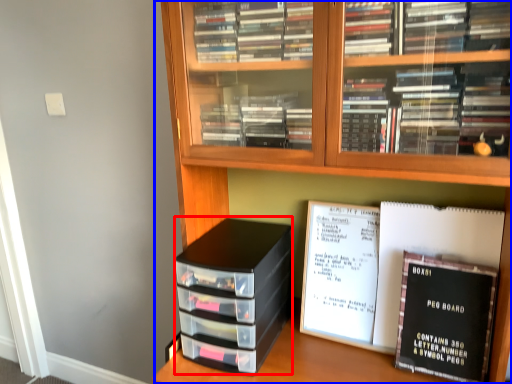
Question: Which object appears farthest to the camera in this image, stack (highlighted by a red box) or bookcase (highlighted by a blue box)?

Choices:
 (A) stack
 (B) bookcase

Answer: (A)